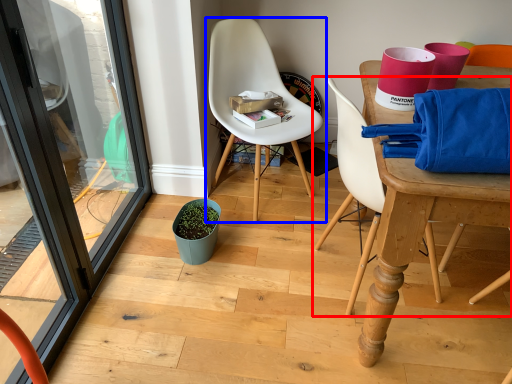
Question: Which object appears closest to the camera in this image, chair (highlighted by a red box) or chair (highlighted by a blue box)?

Choices:
 (A) chair
 (B) chair

Answer: (A)